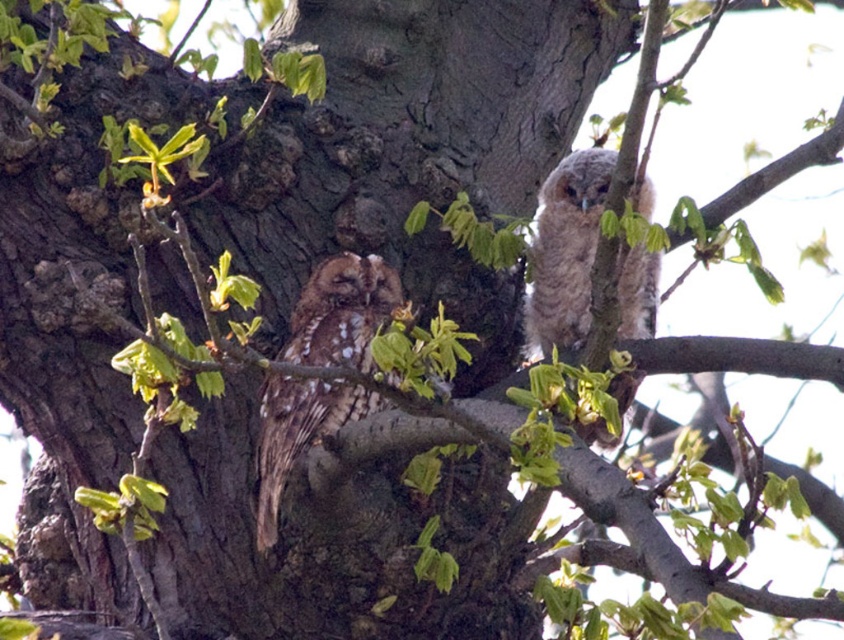
Can you confirm if brown speckled owl at left is bigger than speckled brown owl at upper right?

Incorrect, brown speckled owl at left is not larger than speckled brown owl at upper right.

Which is below, brown speckled owl at left or speckled brown owl at upper right?

brown speckled owl at left is below.

Looking at this image, measure the distance between point (338, 419) and camera.

2.74 meters

Where is `brown speckled owl at left`? This screenshot has width=844, height=640. brown speckled owl at left is located at coordinates (341, 312).